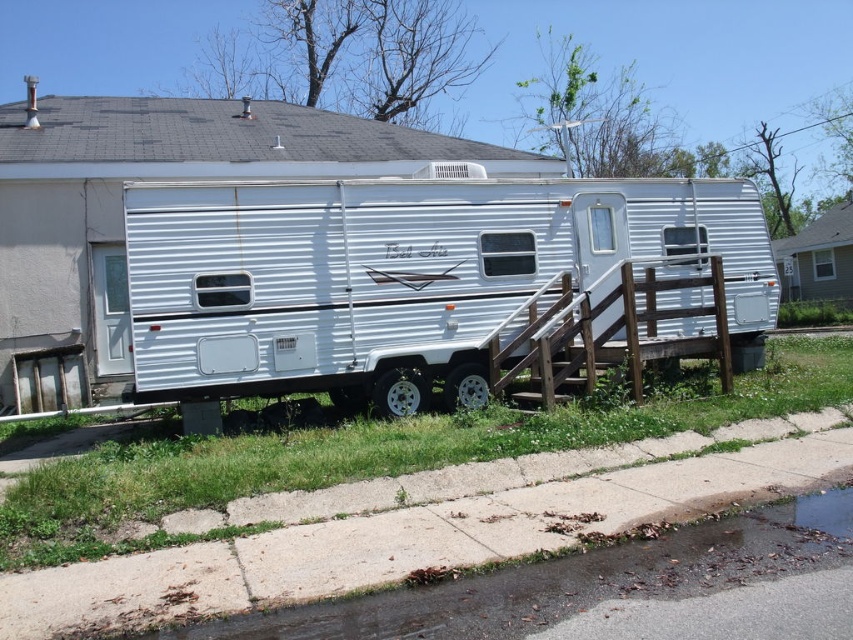
You are standing at the entrance of the trailer and want to walk towards the house. Which point, point (x=457, y=291) or point (x=526, y=304), would you pass first?

You would pass point (x=457, y=291) first because it is in front of point (x=526, y=304) along your path towards the house.

Consider the image. You are planning to move a large piece of furniture into the white metallic trailer at center. Considering the size of the wooden rail at center, can the furniture fit inside the trailer?

The white metallic trailer at center has a larger size compared to wooden rail at center, so the furniture should fit inside the trailer as it is bigger than the wooden rail.